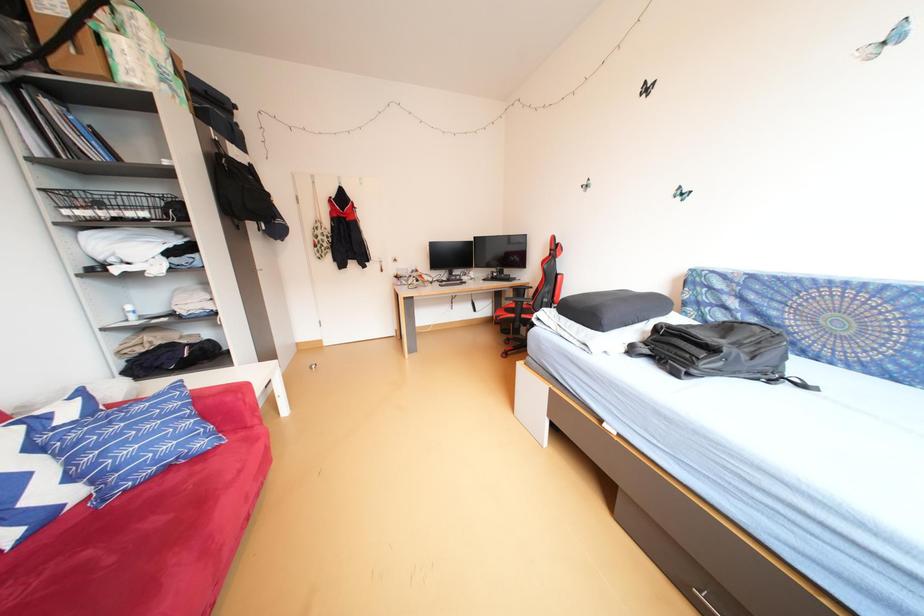
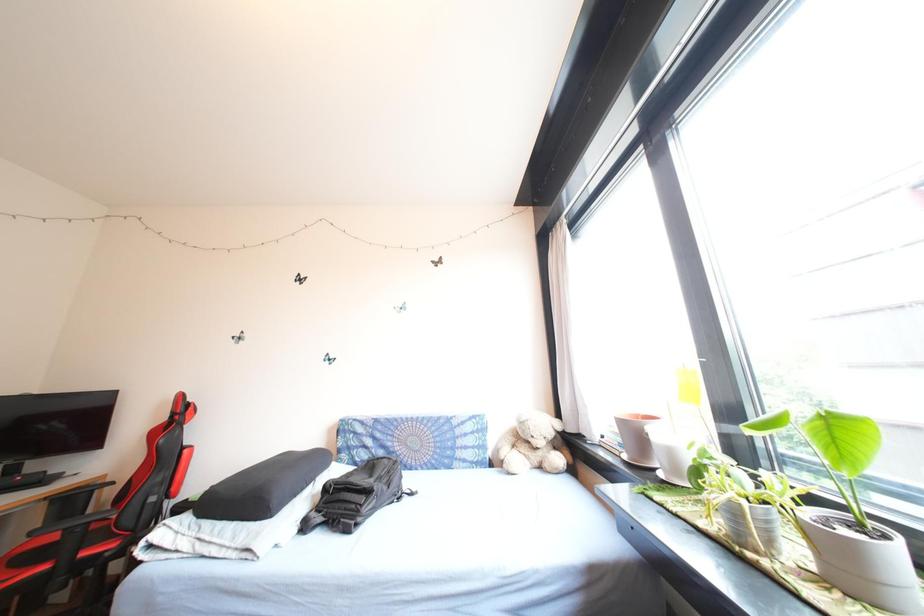
The images are taken continuously from a first-person perspective. In which direction is your viewpoint rotating?

The camera's rotation is toward right-up.